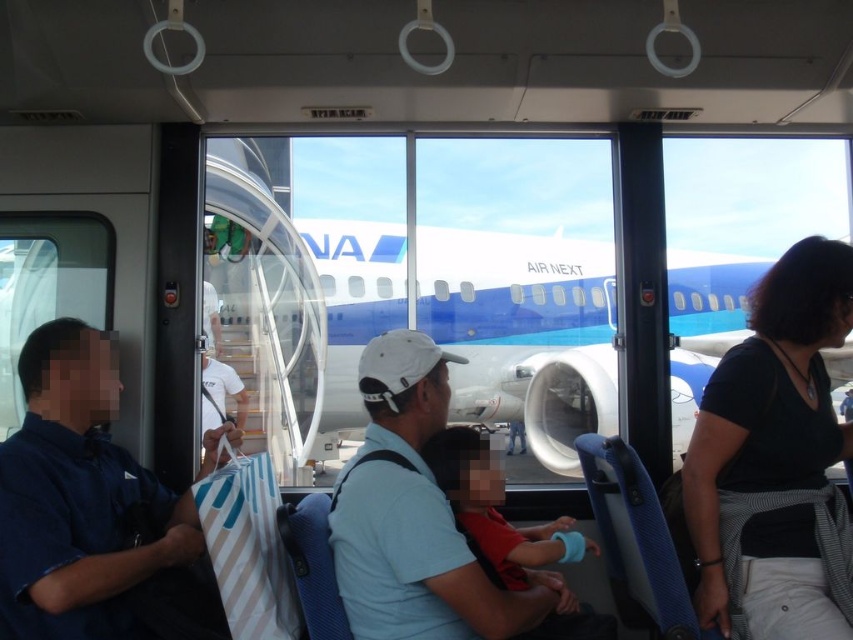
Question: Which of the following is the farthest from the observer?

Choices:
 (A) (801, 316)
 (B) (114, 371)

Answer: (B)

Question: Observing the image, what is the correct spatial positioning of black fabric shirt at right in reference to blue fabric bag at left?

Choices:
 (A) below
 (B) above

Answer: (B)

Question: Which object is closer to the camera taking this photo?

Choices:
 (A) black fabric shirt at right
 (B) blue fabric bag at left

Answer: (B)

Question: Can you confirm if black fabric shirt at right is positioned to the left of blue fabric bag at left?

Choices:
 (A) no
 (B) yes

Answer: (A)

Question: Is black fabric shirt at right positioned at the back of blue fabric bag at left?

Choices:
 (A) yes
 (B) no

Answer: (A)

Question: Which object is closer to the camera taking this photo?

Choices:
 (A) black fabric shirt at right
 (B) blue fabric bag at left

Answer: (B)